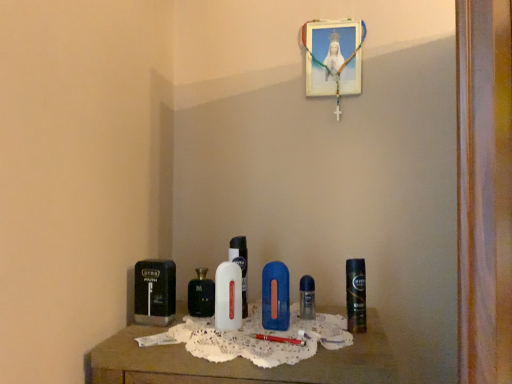
Identify the location of vacant space to the right of blue plastic razor at center, arranged as the second personal care when viewed from the right. This screenshot has height=384, width=512. (318, 329).